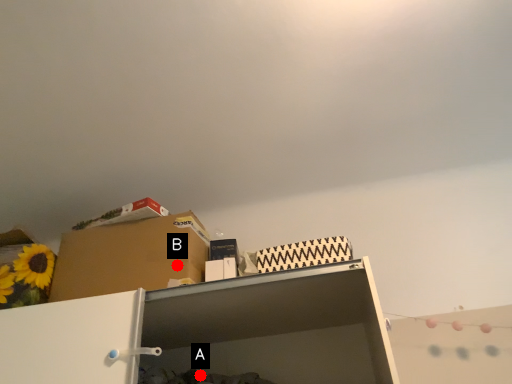
Question: Two points are circled on the image, labeled by A and B beside each circle. Which point is farther from the camera taking this photo?

Choices:
 (A) A is further
 (B) B is further

Answer: (A)